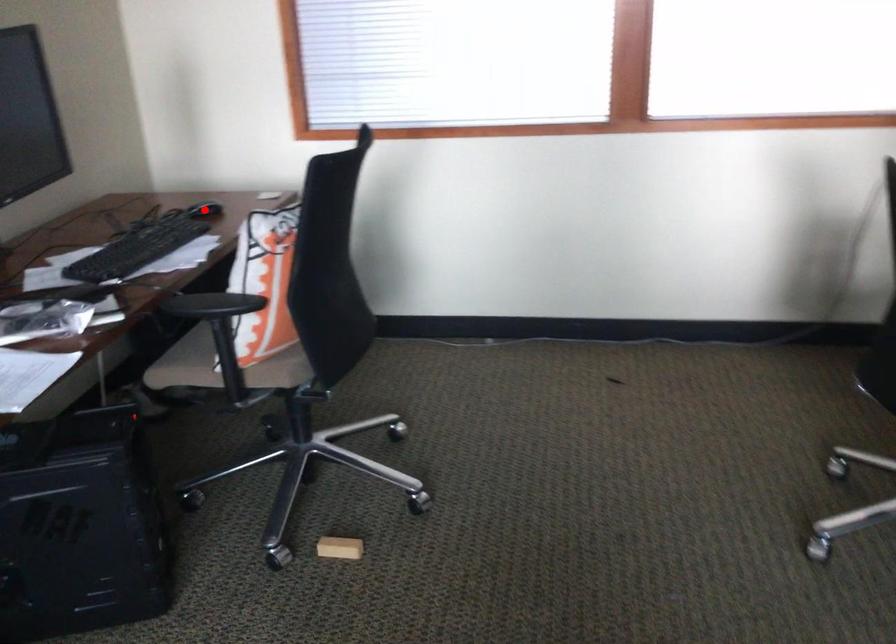
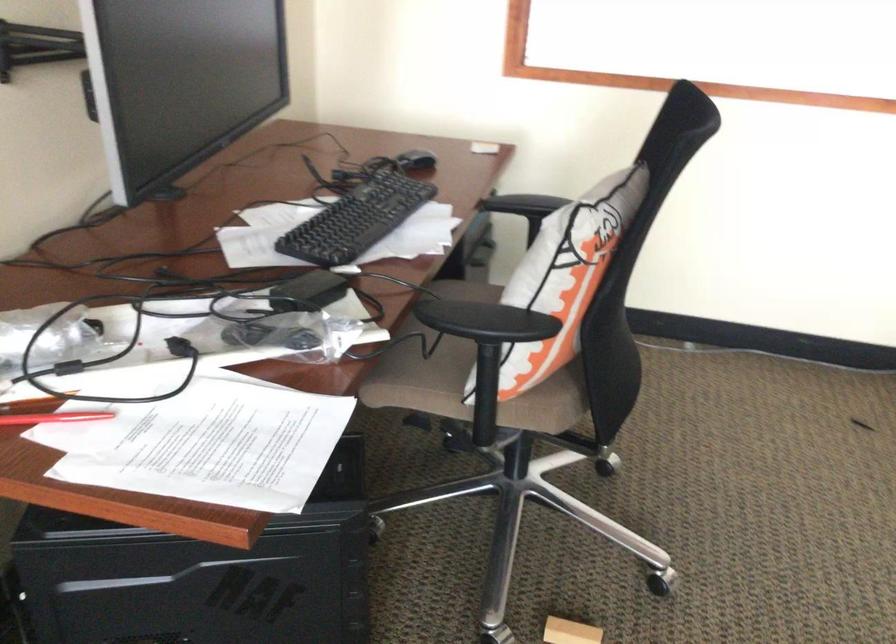
Question: I am providing you with two images of the same scene from different viewpoints. A red point is shown in image1. For the corresponding object point in image2, is it positioned nearer or farther from the camera?

Choices:
 (A) Nearer
 (B) Farther

Answer: (A)